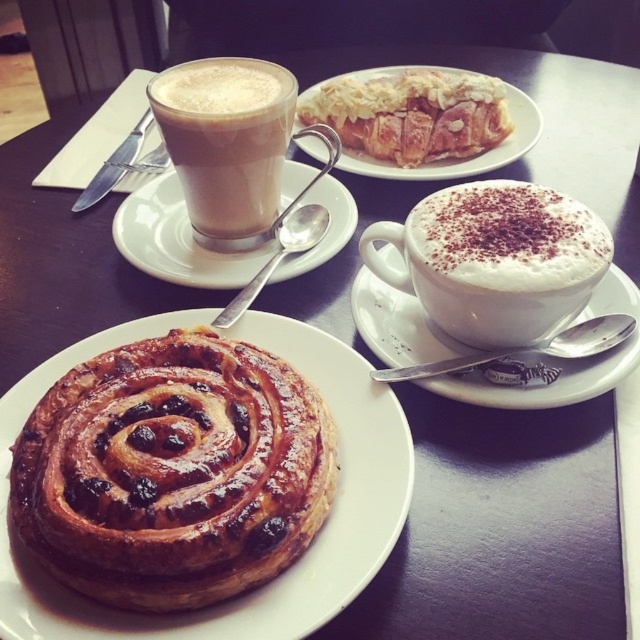
Question: Based on their relative distances, which object is nearer to the white ceramic saucer at upper left?

Choices:
 (A) white frothy coffee at right
 (B) white ceramic saucer at upper right
 (C) golden flaky pastry at upper center
 (D) matte glass cup at upper left

Answer: (D)

Question: Is white frothy coffee at right positioned before golden flaky pastry at upper center?

Choices:
 (A) no
 (B) yes

Answer: (B)

Question: Is white frothy coffee at right below matte glass cup at upper left?

Choices:
 (A) yes
 (B) no

Answer: (A)

Question: In this image, where is golden flaky pastry at upper center located relative to white ceramic saucer at upper left?

Choices:
 (A) right
 (B) left

Answer: (A)

Question: Which of these objects is positioned farthest from the golden flaky pastry at upper center?

Choices:
 (A) white frothy coffee at right
 (B) matte glass cup at upper left
 (C) white ceramic saucer at upper right

Answer: (A)

Question: Which point is closer to the camera taking this photo?

Choices:
 (A) (396, 321)
 (B) (216, 474)
 (C) (340, 136)

Answer: (B)